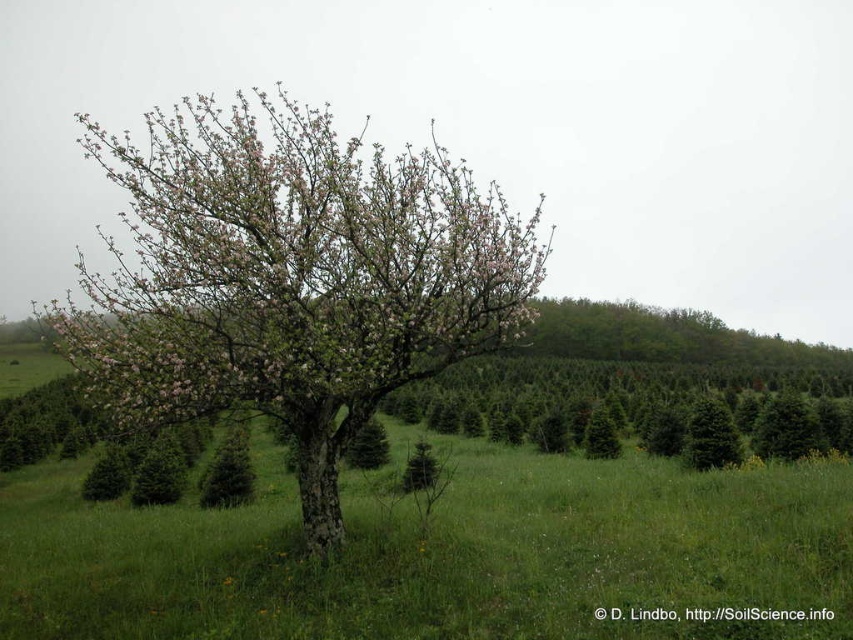
How far apart are green grassy at center and pink bloom at center?

The distance of green grassy at center from pink bloom at center is 23.68 feet.

From the picture: Is green grassy at center smaller than pink bloom at center?

Indeed, green grassy at center has a smaller size compared to pink bloom at center.

At what (x,y) coordinates should I click in order to perform the action: click on green grassy at center. Please return your answer as a coordinate pair (x, y). The image size is (853, 640). Looking at the image, I should click on (434, 552).